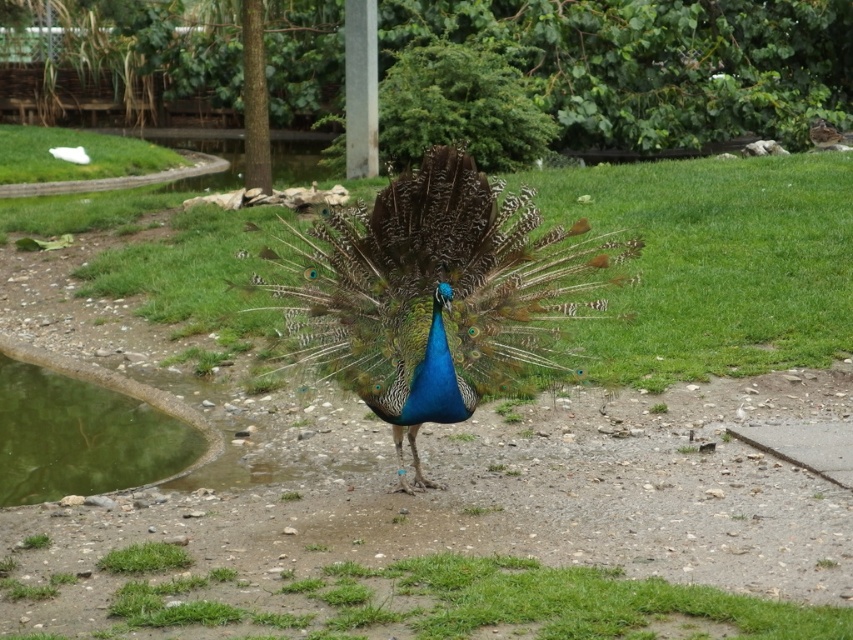
You are a photographer planning to take a closeup shot of the shiny blue peacock at center and the green grass at center. Which object should you focus on first if you want to capture both in sharp focus?

The shiny blue peacock at center is larger in size than the green grass at center, so you should focus on the shiny blue peacock at center first to ensure both are in sharp focus.

You are a small insect that just landed on the green grass at center. You want to reach the green reflective water at lower left. Which direction should you crawl to get closer to the water?

The green reflective water at lower left is located to the left side of the green grass at center, so you should crawl towards the left to get closer to the water.